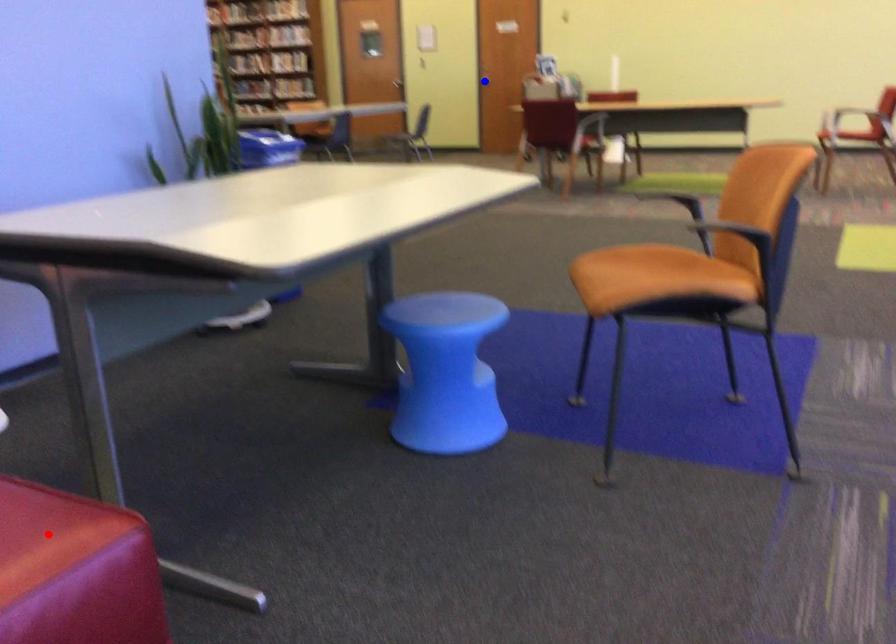
Question: In the image, two points are highlighted. Which point is nearer to the camera? Reply with the corresponding letter.

Choices:
 (A) blue point
 (B) red point

Answer: (B)